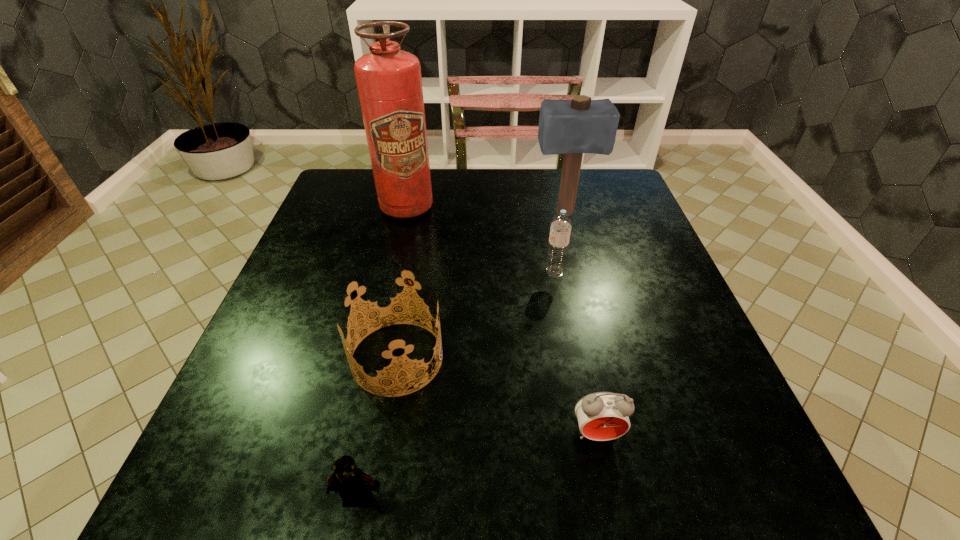
The image size is (960, 540). Identify the location of fire extinguisher. (389, 82).

Find the location of a particular element. The image size is (960, 540). the second tallest object is located at coordinates (572, 127).

Locate an element on the screen. Image resolution: width=960 pixels, height=540 pixels. the third farthest object is located at coordinates coord(561,225).

This screenshot has height=540, width=960. Identify the location of the third nearest object. (382, 298).

Where is `the second nearest object`? the second nearest object is located at coordinates (602, 416).

Find the location of a particular element. the nearest object is located at coordinates (352, 484).

Image resolution: width=960 pixels, height=540 pixels. I want to click on free region located 0.340m on the label side of the tallest object, so (x=380, y=321).

Identify the location of free space located on the front of the fifth shortest object. (580, 276).

This screenshot has width=960, height=540. Identify the location of free region located on the left of the third farthest object. (517, 272).

Identify the location of free spot located on the right of the third nearest object. Image resolution: width=960 pixels, height=540 pixels. (617, 357).